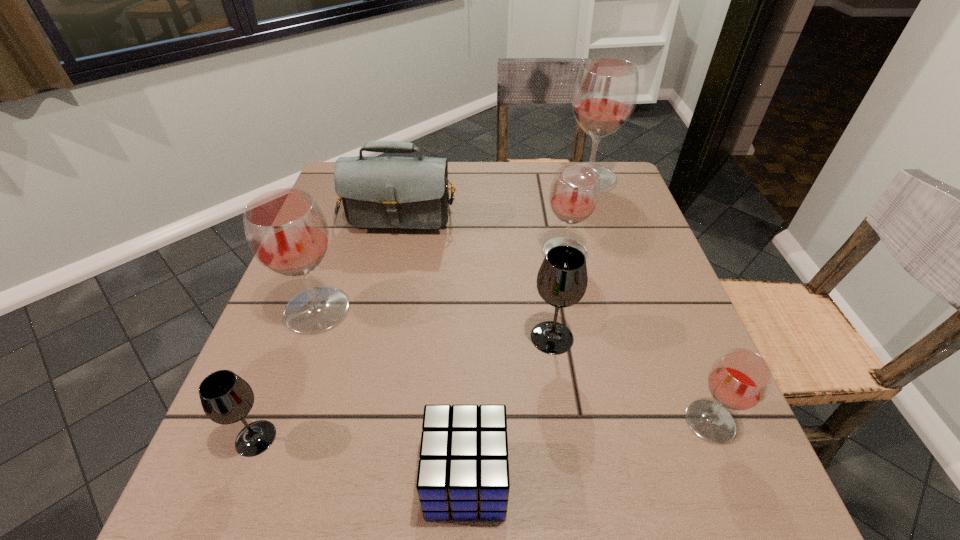
You are a GUI agent. You are given a task and a screenshot of the screen. Output one action in this format:
    pyautogui.click(x=<x>, y=<y>)
    Task: Click on the vacant space that's between the nearest red wineglass and the third biggest red wineglass
    The image size is (960, 540).
    Given the screenshot: What is the action you would take?
    pyautogui.click(x=637, y=337)

The width and height of the screenshot is (960, 540). I want to click on vacant space that is in between the farther gray wineglass and the shoulder bag, so click(x=477, y=268).

What are the coordinates of `free spot between the bigger gray wineglass and the shoulder bag` in the screenshot? It's located at (477, 268).

Identify which object is the fifth nearest to the right gray wineglass. Please provide its 2D coordinates. Your answer should be formatted as a tuple, i.e. [(x, y)], where the tuple contains the x and y coordinates of a point satisfying the conditions above.

[(286, 231)]

You are a GUI agent. You are given a task and a screenshot of the screen. Output one action in this format:
    pyautogui.click(x=<x>, y=<y>)
    Task: Click on the object identified as the fifth closest to the shoulder bag
    
    Given the screenshot: What is the action you would take?
    pyautogui.click(x=226, y=398)

Locate an element on the screen. wineglass that is the second closest one to the biggest red wineglass is located at coordinates (562, 279).

Select which wineglass is the fifth closest to the smaller gray wineglass. Please provide its 2D coordinates. Your answer should be formatted as a tuple, i.e. [(x, y)], where the tuple contains the x and y coordinates of a point satisfying the conditions above.

[(605, 92)]

Point out which red wineglass is positioned as the fourth nearest to the red cube. Please provide its 2D coordinates. Your answer should be formatted as a tuple, i.e. [(x, y)], where the tuple contains the x and y coordinates of a point satisfying the conditions above.

[(605, 92)]

Locate an element on the screen. red wineglass that stands as the third closest to the right gray wineglass is located at coordinates (286, 231).

The width and height of the screenshot is (960, 540). Identify the location of free location that satisfies the following two spatial constraints: 1. on the back side of the third smallest red wineglass; 2. on the left side of the smaller gray wineglass. pos(304,310).